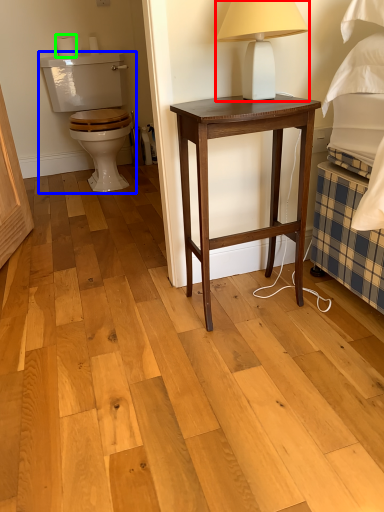
Question: Which is nearer to the table lamp (highlighted by a red box)? armchair (highlighted by a blue box) or toilet paper (highlighted by a green box).

Choices:
 (A) armchair
 (B) toilet paper

Answer: (A)